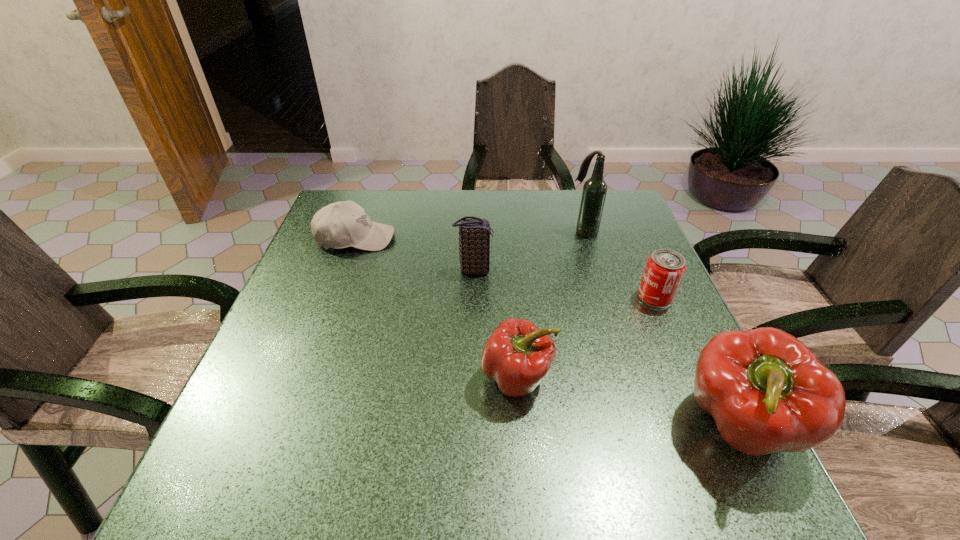
You are a GUI agent. You are given a task and a screenshot of the screen. Output one action in this format:
    pyautogui.click(x=<x>, y=<y>)
    Task: Click on the object at the far left corner
    Image resolution: width=960 pixels, height=540 pixels.
    Given the screenshot: What is the action you would take?
    pyautogui.click(x=345, y=224)

Where is `object that is positioned at the far right corner`? object that is positioned at the far right corner is located at coordinates (594, 191).

The width and height of the screenshot is (960, 540). Identify the location of object that is at the near right corner. (766, 390).

Locate an element on the screen. free space at the far edge of the desktop is located at coordinates (575, 233).

Where is `vacant region at the near edge`? The image size is (960, 540). vacant region at the near edge is located at coordinates (355, 410).

In the image, there is a desktop. Where is `vacant space at the left edge`? The width and height of the screenshot is (960, 540). vacant space at the left edge is located at coordinates (307, 293).

Find the location of a particular element. free location at the right edge of the desktop is located at coordinates (635, 376).

The width and height of the screenshot is (960, 540). I want to click on vacant region at the far left corner of the desktop, so click(x=378, y=215).

The height and width of the screenshot is (540, 960). What are the coordinates of `vacant space at the near left corner of the desktop` in the screenshot? It's located at (296, 423).

You are a GUI agent. You are given a task and a screenshot of the screen. Output one action in this format:
    pyautogui.click(x=<x>, y=<y>)
    Task: Click on the free location at the far right corner of the desktop
    
    Given the screenshot: What is the action you would take?
    pyautogui.click(x=602, y=222)